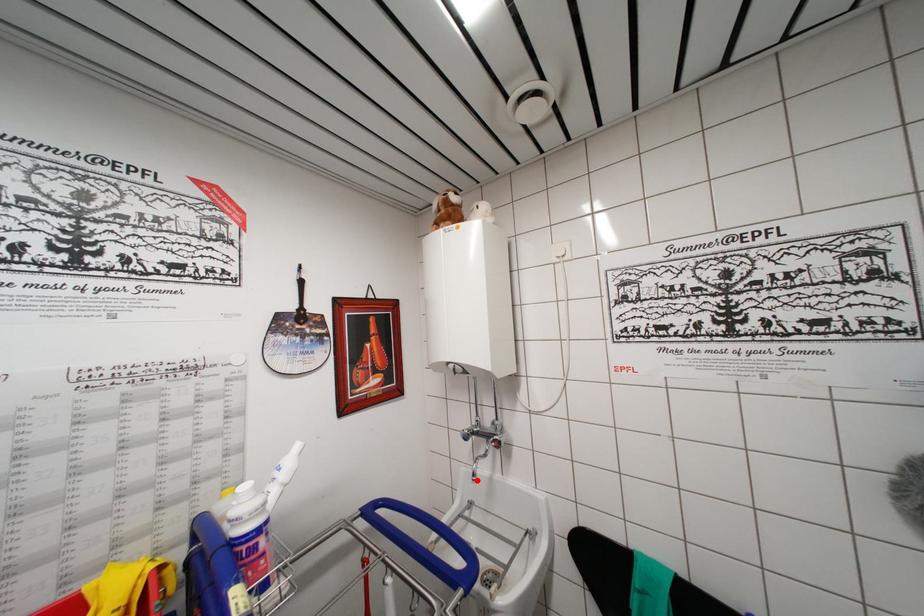
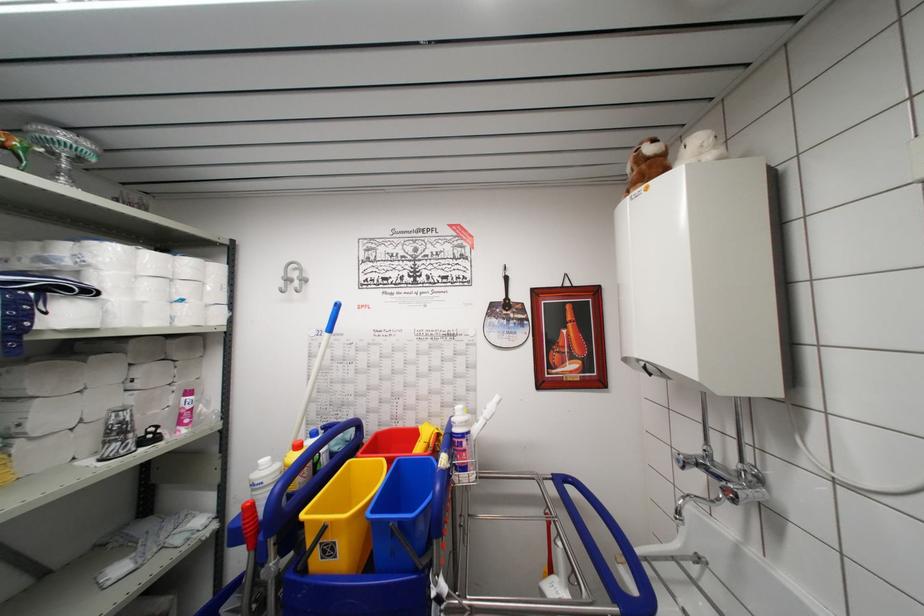
The point at the highlighted location is marked in the first image. Where is the corresponding point in the second image?

(681, 517)